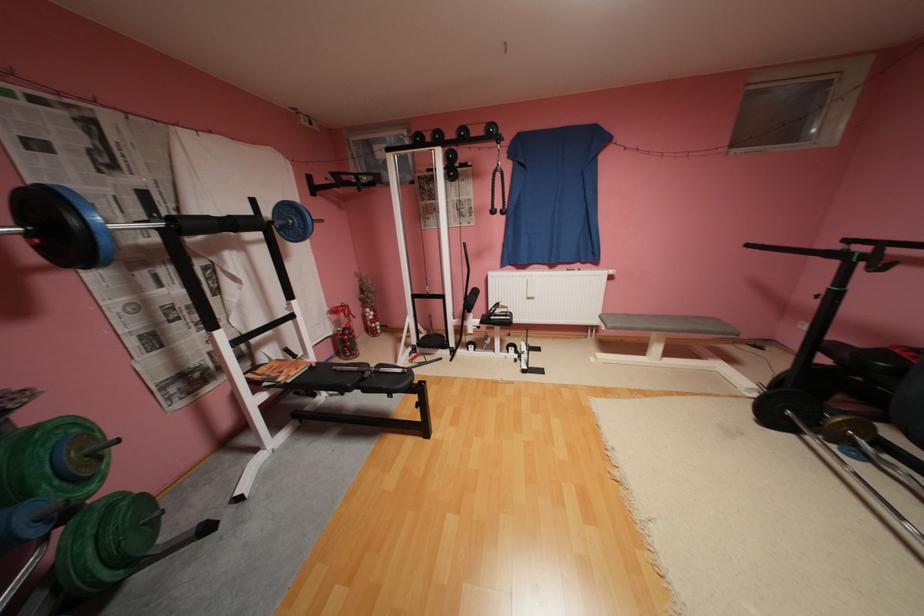
Where would you sit the black seat surface? Please return your answer as a coordinate pair (x, y).

(349, 382)